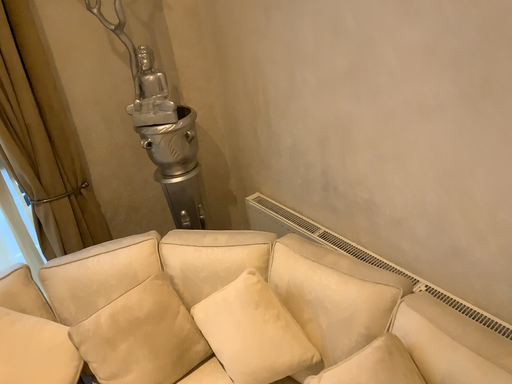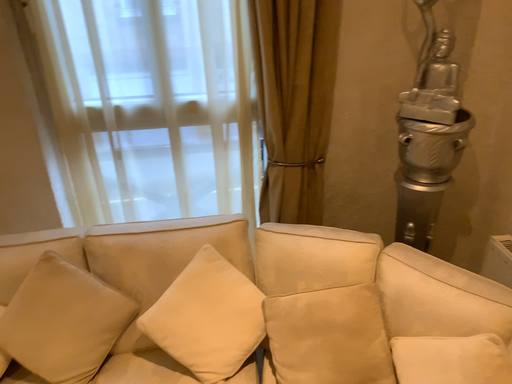
Question: How did the camera likely rotate when shooting the video?

Choices:
 (A) rotated left
 (B) rotated right

Answer: (A)